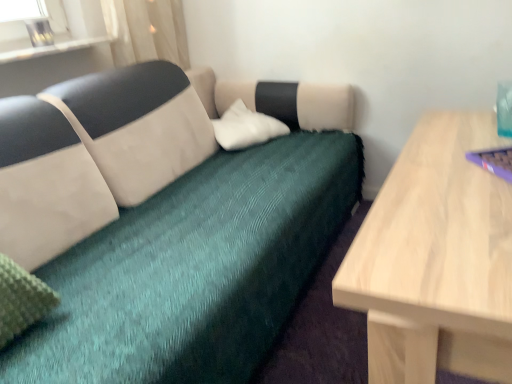
Question: Would you say clear glass vase at upper left is outside purple plastic laptop at right?

Choices:
 (A) yes
 (B) no

Answer: (A)

Question: Are clear glass vase at upper left and purple plastic laptop at right making contact?

Choices:
 (A) yes
 (B) no

Answer: (B)

Question: Could you tell me if clear glass vase at upper left is turned towards purple plastic laptop at right?

Choices:
 (A) yes
 (B) no

Answer: (A)

Question: Is the position of clear glass vase at upper left less distant than that of purple plastic laptop at right?

Choices:
 (A) no
 (B) yes

Answer: (A)

Question: From a real-world perspective, is clear glass vase at upper left located higher than purple plastic laptop at right?

Choices:
 (A) no
 (B) yes

Answer: (B)

Question: Is clear glass vase at upper left shorter than purple plastic laptop at right?

Choices:
 (A) yes
 (B) no

Answer: (B)

Question: Is white soft pillow at center located outside clear glass vase at upper left?

Choices:
 (A) no
 (B) yes

Answer: (B)

Question: Can you confirm if white soft pillow at center is positioned to the left of clear glass vase at upper left?

Choices:
 (A) yes
 (B) no

Answer: (B)

Question: Can you confirm if white soft pillow at center is thinner than clear glass vase at upper left?

Choices:
 (A) no
 (B) yes

Answer: (A)

Question: Considering the relative positions of white soft pillow at center and clear glass vase at upper left in the image provided, is white soft pillow at center to the right of clear glass vase at upper left from the viewer's perspective?

Choices:
 (A) no
 (B) yes

Answer: (B)

Question: Can you confirm if white soft pillow at center is wider than clear glass vase at upper left?

Choices:
 (A) yes
 (B) no

Answer: (A)

Question: Does white soft pillow at center come behind clear glass vase at upper left?

Choices:
 (A) yes
 (B) no

Answer: (A)

Question: Considering the relative sizes of teal fabric couch at center and white soft pillow at center in the image provided, is teal fabric couch at center smaller than white soft pillow at center?

Choices:
 (A) yes
 (B) no

Answer: (B)